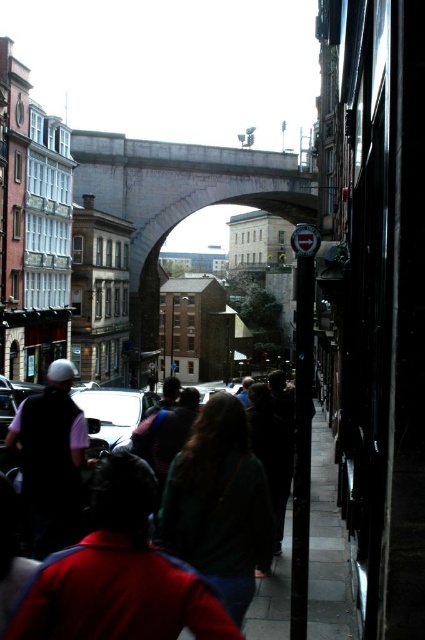
Question: Does stone archway at center have a lesser width compared to dark green fabric crowd at center?

Choices:
 (A) no
 (B) yes

Answer: (A)

Question: Which of the following is the farthest from the observer?

Choices:
 (A) (336, 493)
 (B) (218, 493)
 (C) (221, 476)

Answer: (A)

Question: Considering the relative positions of stone archway at center and dark green fabric crowd at center in the image provided, where is stone archway at center located with respect to dark green fabric crowd at center?

Choices:
 (A) left
 (B) right

Answer: (A)

Question: Can you confirm if dark green sweater at center is thinner than shiny silver car at center?

Choices:
 (A) no
 (B) yes

Answer: (B)

Question: Which object is closer to the camera taking this photo?

Choices:
 (A) shiny silver car at center
 (B) stone archway at center

Answer: (A)

Question: Which of these objects is positioned closest to the stone archway at center?

Choices:
 (A) shiny silver car at center
 (B) dark green fabric crowd at center
 (C) dark green sweater at center
 (D) dark gray concrete pavement at lower right

Answer: (A)